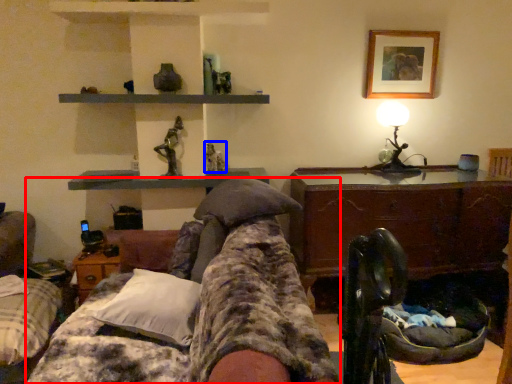
Question: Which object appears farthest to the camera in this image, furniture (highlighted by a red box) or toy (highlighted by a blue box)?

Choices:
 (A) furniture
 (B) toy

Answer: (B)